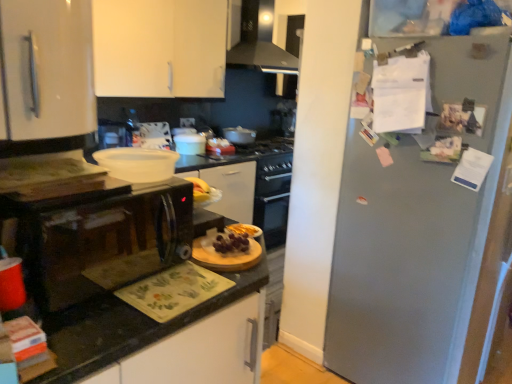
The height and width of the screenshot is (384, 512). Find the location of `blank space situated above white matte bowl at center (from a real-world perspective)`. blank space situated above white matte bowl at center (from a real-world perspective) is located at coordinates (123, 150).